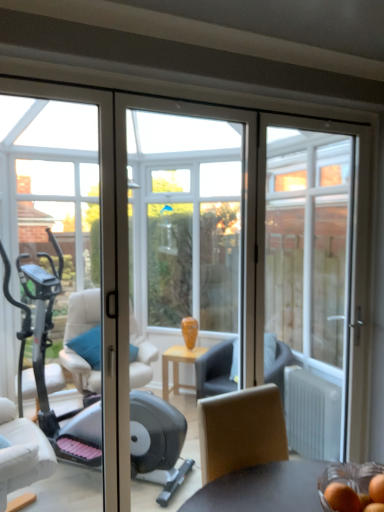
Question: Is transparent glass door at right completely or partially outside of orange matte/orange at lower right, the second food when ordered from right to left?

Choices:
 (A) no
 (B) yes

Answer: (B)

Question: From the image's perspective, would you say transparent glass door at right is shown under orange matte/orange at lower right, the second food when ordered from right to left?

Choices:
 (A) no
 (B) yes

Answer: (A)

Question: Is transparent glass door at right to the left of orange matte/orange at lower right, which appears as the first food when viewed from the left, from the viewer's perspective?

Choices:
 (A) no
 (B) yes

Answer: (A)

Question: From a real-world perspective, is transparent glass door at right located beneath orange matte/orange at lower right, the second food when ordered from right to left?

Choices:
 (A) yes
 (B) no

Answer: (B)

Question: Is the surface of transparent glass door at right in direct contact with orange matte/orange at lower right, the second food when ordered from right to left?

Choices:
 (A) yes
 (B) no

Answer: (B)

Question: Considering the positions of orange matte/orange at lower right, the second food when ordered from right to left, and transparent glass door at right in the image, is orange matte/orange at lower right, the second food when ordered from right to left, bigger or smaller than transparent glass door at right?

Choices:
 (A) small
 (B) big

Answer: (A)

Question: In the image, is orange matte/orange at lower right, which appears as the first food when viewed from the left, on the left side or the right side of transparent glass door at right?

Choices:
 (A) right
 (B) left

Answer: (B)

Question: Is orange matte/orange at lower right, the second food when ordered from right to left, taller or shorter than transparent glass door at right?

Choices:
 (A) tall
 (B) short

Answer: (B)

Question: From a real-world perspective, relative to transparent glass door at right, is orange matte/orange at lower right, which appears as the first food when viewed from the left, vertically above or below?

Choices:
 (A) above
 (B) below

Answer: (B)

Question: Considering the positions of smooth orange fruit at lower right, which is the first food in right-to-left order, and transparent glass door at right in the image, is smooth orange fruit at lower right, which is the first food in right-to-left order, wider or thinner than transparent glass door at right?

Choices:
 (A) wide
 (B) thin

Answer: (B)

Question: From the image's perspective, is smooth orange fruit at lower right, the second food when ordered from left to right, positioned above or below transparent glass door at right?

Choices:
 (A) above
 (B) below

Answer: (B)

Question: In terms of height, does smooth orange fruit at lower right, which is the first food in right-to-left order, look taller or shorter compared to transparent glass door at right?

Choices:
 (A) short
 (B) tall

Answer: (A)

Question: Which is correct: smooth orange fruit at lower right, which is the first food in right-to-left order, is inside transparent glass door at right, or outside of it?

Choices:
 (A) inside
 (B) outside

Answer: (B)

Question: Visually, is smooth orange fruit at lower right, which is the first food in right-to-left order, positioned to the left or to the right of orange matte/orange at lower right, the second food when ordered from right to left?

Choices:
 (A) left
 (B) right

Answer: (B)

Question: From the image's perspective, is smooth orange fruit at lower right, which is the first food in right-to-left order, positioned above or below orange matte/orange at lower right, which appears as the first food when viewed from the left?

Choices:
 (A) above
 (B) below

Answer: (A)